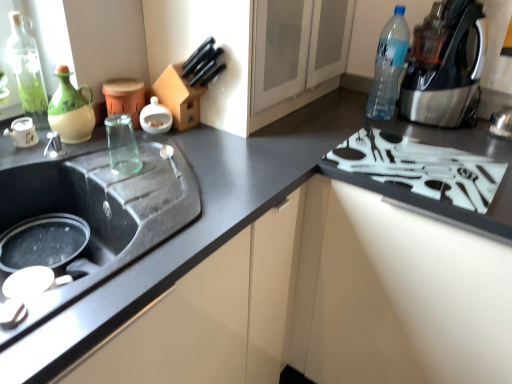
Identify the location of vacant space that is in between blue plastic bottle at upper right, the 1th bottle in the right-to-left sequence, and white plastic gas stove at right. This screenshot has height=384, width=512. coord(410,133).